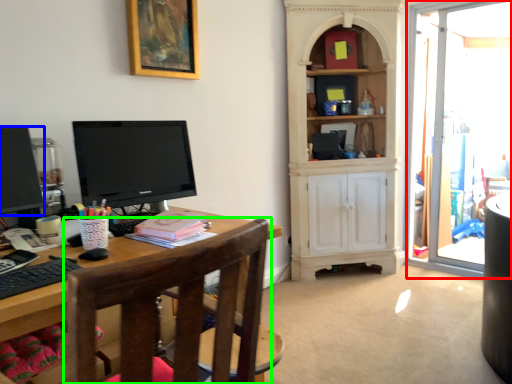
Question: Based on their relative distances, which object is farther from glass door (highlighted by a red box)? Choose from computer monitor (highlighted by a blue box) and chair (highlighted by a green box).

Choices:
 (A) computer monitor
 (B) chair

Answer: (A)